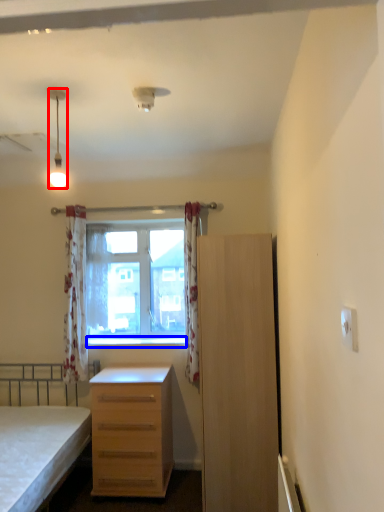
Question: Which object appears closest to the camera in this image, lamp (highlighted by a red box) or window sill (highlighted by a blue box)?

Choices:
 (A) lamp
 (B) window sill

Answer: (A)